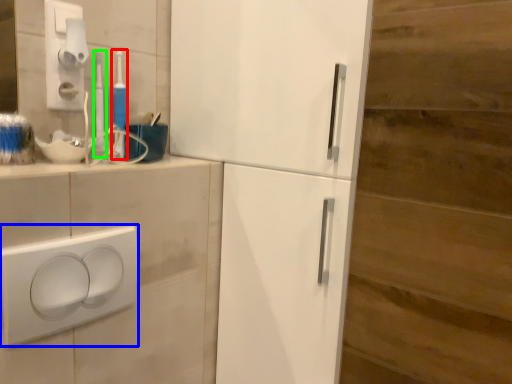
Question: Which is nearer to the toothbrush (highlighted by a red box)? light switch (highlighted by a blue box) or toothbrush (highlighted by a green box).

Choices:
 (A) light switch
 (B) toothbrush

Answer: (B)